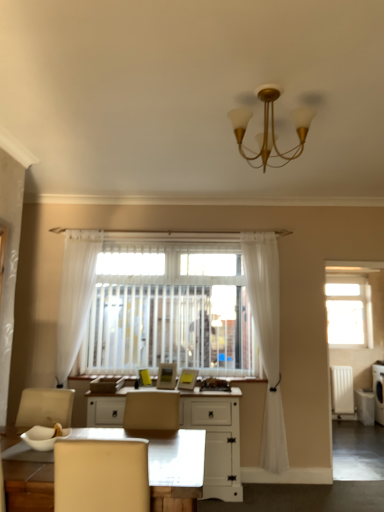
I want to click on matte yellow picture frame at center, which is the first picture frame from right to left, so click(x=187, y=379).

This screenshot has width=384, height=512. I want to click on gold metallic chandelier at upper center, so click(x=270, y=129).

Where is `white plastic radiator at right`? The width and height of the screenshot is (384, 512). white plastic radiator at right is located at coordinates (342, 389).

Identify the location of white sheer curtain at center, the first curtain when ordered from right to left. (267, 339).

Which is behind, white plastic radiator at right or gold metallic chandelier at upper center?

white plastic radiator at right is more distant.

Considering the positions of objects white plastic radiator at right and gold metallic chandelier at upper center in the image provided, who is more to the right, white plastic radiator at right or gold metallic chandelier at upper center?

white plastic radiator at right.

Is white plastic radiator at right taller than gold metallic chandelier at upper center?

Indeed, white plastic radiator at right has a greater height compared to gold metallic chandelier at upper center.

Can you confirm if white plastic radiator at right is wider than gold metallic chandelier at upper center?

No, white plastic radiator at right is not wider than gold metallic chandelier at upper center.

From a real-world perspective, is matte yellow picture frame at center, marked as the 1th picture frame in a left-to-right arrangement, beneath white glossy desk at lower center?

No, from a real-world perspective, matte yellow picture frame at center, marked as the 1th picture frame in a left-to-right arrangement, is not below white glossy desk at lower center.

Based on the photo, considering the relative positions of matte yellow picture frame at center, which appears as the 2th picture frame when viewed from the right, and white glossy desk at lower center in the image provided, is matte yellow picture frame at center, which appears as the 2th picture frame when viewed from the right, to the left of white glossy desk at lower center from the viewer's perspective?

Incorrect, matte yellow picture frame at center, which appears as the 2th picture frame when viewed from the right, is not on the left side of white glossy desk at lower center.

Is matte yellow picture frame at center, which appears as the 2th picture frame when viewed from the right, touching white glossy desk at lower center?

No.

Is white glossy desk at lower center a part of matte yellow picture frame at center, which appears as the 2th picture frame when viewed from the right?

No, matte yellow picture frame at center, which appears as the 2th picture frame when viewed from the right, does not contain white glossy desk at lower center.

Where is `desk lying above the white plastic radiator at right (from the image's perspective)`? desk lying above the white plastic radiator at right (from the image's perspective) is located at coordinates (177, 471).

Could you tell me if white glossy desk at lower center is turned towards white plastic radiator at right?

No.

From a real-world perspective, is white glossy desk at lower center physically above white plastic radiator at right?

Indeed, from a real-world perspective, white glossy desk at lower center stands above white plastic radiator at right.

Does white glossy desk at lower center have a greater width compared to white plastic radiator at right?

Indeed, white glossy desk at lower center has a greater width compared to white plastic radiator at right.

Is white painted wood desk at center not inside transparent glass window at upper right?

That's correct, white painted wood desk at center is outside of transparent glass window at upper right.

Where is `window located above the white painted wood desk at center (from a real-world perspective)`? window located above the white painted wood desk at center (from a real-world perspective) is located at coordinates (349, 311).

In terms of height, does white painted wood desk at center look taller or shorter compared to transparent glass window at upper right?

Clearly, white painted wood desk at center is shorter compared to transparent glass window at upper right.

Consider the image. Is gold metallic chandelier at upper center outside of white plastic radiator at right?

gold metallic chandelier at upper center is positioned outside white plastic radiator at right.

From a real-world perspective, between gold metallic chandelier at upper center and white plastic radiator at right, who is vertically higher?

In real-world perspective, gold metallic chandelier at upper center is above.

Considering the relative sizes of gold metallic chandelier at upper center and white plastic radiator at right in the image provided, is gold metallic chandelier at upper center bigger than white plastic radiator at right?

Yes, gold metallic chandelier at upper center is bigger than white plastic radiator at right.

Is gold metallic chandelier at upper center facing towards white plastic radiator at right?

No, gold metallic chandelier at upper center is not oriented towards white plastic radiator at right.

Can you confirm if matte yellow picture frame at center, marked as the 1th picture frame in a left-to-right arrangement, is shorter than white sheer curtain at center, which ranks as the second curtain in left-to-right order?

Correct, matte yellow picture frame at center, marked as the 1th picture frame in a left-to-right arrangement, is not as tall as white sheer curtain at center, which ranks as the second curtain in left-to-right order.

What are the coordinates of `curtain on the right of the matte yellow picture frame at center, which appears as the 2th picture frame when viewed from the right` in the screenshot? It's located at (267, 339).

Considering the sizes of objects matte yellow picture frame at center, which appears as the 2th picture frame when viewed from the right, and white sheer curtain at center, which ranks as the second curtain in left-to-right order, in the image provided, who is thinner, matte yellow picture frame at center, which appears as the 2th picture frame when viewed from the right, or white sheer curtain at center, which ranks as the second curtain in left-to-right order,?

matte yellow picture frame at center, which appears as the 2th picture frame when viewed from the right, is thinner.

Is white sheer curtain at center, which ranks as the second curtain in left-to-right order, a part of matte yellow picture frame at center, marked as the 1th picture frame in a left-to-right arrangement?

Definitely not — white sheer curtain at center, which ranks as the second curtain in left-to-right order, is not inside matte yellow picture frame at center, marked as the 1th picture frame in a left-to-right arrangement.

Does matte yellow picture frame at center, which appears as the 2th picture frame when viewed from the right, have a lesser width compared to matte yellow picture frame at center, which is the first picture frame from right to left?

Indeed, matte yellow picture frame at center, which appears as the 2th picture frame when viewed from the right, has a lesser width compared to matte yellow picture frame at center, which is the first picture frame from right to left.

From the image's perspective, is matte yellow picture frame at center, which appears as the 2th picture frame when viewed from the right, located above or below matte yellow picture frame at center, the second picture frame viewed from the left?

matte yellow picture frame at center, which appears as the 2th picture frame when viewed from the right, is above matte yellow picture frame at center, the second picture frame viewed from the left.

Can matte yellow picture frame at center, which is the first picture frame from right to left, be found inside matte yellow picture frame at center, which appears as the 2th picture frame when viewed from the right?

No, matte yellow picture frame at center, which appears as the 2th picture frame when viewed from the right, does not contain matte yellow picture frame at center, which is the first picture frame from right to left.

You are a GUI agent. You are given a task and a screenshot of the screen. Output one action in this format:
    pyautogui.click(x=<x>, y=<y>)
    Task: Click on the radiator below the gold metallic chandelier at upper center (from the image's perspective)
    This screenshot has width=384, height=512.
    Given the screenshot: What is the action you would take?
    pyautogui.click(x=342, y=389)

I want to click on desk to the left of matte yellow picture frame at center, marked as the 1th picture frame in a left-to-right arrangement, so click(177, 471).

Based on the photo, from the image, which object appears to be nearer to transparent glass window at upper right, gold metallic chandelier at upper center or matte yellow picture frame at center, the second picture frame viewed from the left?

matte yellow picture frame at center, the second picture frame viewed from the left.

When comparing their distances from white painted wood desk at center, does white sheer curtain at center, which ranks as the second curtain in left-to-right order, or matte yellow picture frame at center, which is the first picture frame from right to left, seem further?

white sheer curtain at center, which ranks as the second curtain in left-to-right order, lies further to white painted wood desk at center than the other object.

From the image, which object appears to be nearer to white plastic radiator at right, white sheer curtain at left, the second curtain positioned from the right, or matte yellow picture frame at center, marked as the 1th picture frame in a left-to-right arrangement?

Based on the image, matte yellow picture frame at center, marked as the 1th picture frame in a left-to-right arrangement, appears to be nearer to white plastic radiator at right.

From the image, which object appears to be farther from gold metallic chandelier at upper center, white sheer curtain at center, which ranks as the second curtain in left-to-right order, or white glossy desk at lower center?

white sheer curtain at center, which ranks as the second curtain in left-to-right order, is positioned further to the anchor gold metallic chandelier at upper center.

Considering their positions, is white painted wood desk at center positioned closer to transparent glass window at upper right than matte yellow picture frame at center, which appears as the 2th picture frame when viewed from the right?

white painted wood desk at center is positioned closer to the anchor transparent glass window at upper right.

When comparing their distances from transparent glass window at upper right, does white sheer curtain at center, which ranks as the second curtain in left-to-right order, or white plastic radiator at right seem further?

white sheer curtain at center, which ranks as the second curtain in left-to-right order.

From the image, which object appears to be farther from white plastic radiator at right, matte yellow picture frame at center, which is the first picture frame from right to left, or matte yellow picture frame at center, which appears as the 2th picture frame when viewed from the right?

matte yellow picture frame at center, which appears as the 2th picture frame when viewed from the right, is further to white plastic radiator at right.

Looking at the image, which one is located further to white glossy desk at lower center, white sheer curtain at left, the 1th curtain when ordered from left to right, or white plastic radiator at right?

white plastic radiator at right.

Image resolution: width=384 pixels, height=512 pixels. Identify the location of cabinetry between white glossy desk at lower center and transparent glass window at upper right from front to back. (216, 440).

Find the location of a particular element. picture frame between matte yellow picture frame at center, which appears as the 2th picture frame when viewed from the right, and white sheer curtain at center, which ranks as the second curtain in left-to-right order is located at coordinates (187, 379).

Identify the location of cabinetry between white sheer curtain at left, the 1th curtain when ordered from left to right, and white sheer curtain at center, which ranks as the second curtain in left-to-right order. (216, 440).

Where is `cabinetry between white glossy desk at lower center and white sheer curtain at left, the 1th curtain when ordered from left to right, from front to back`? cabinetry between white glossy desk at lower center and white sheer curtain at left, the 1th curtain when ordered from left to right, from front to back is located at coordinates (216, 440).